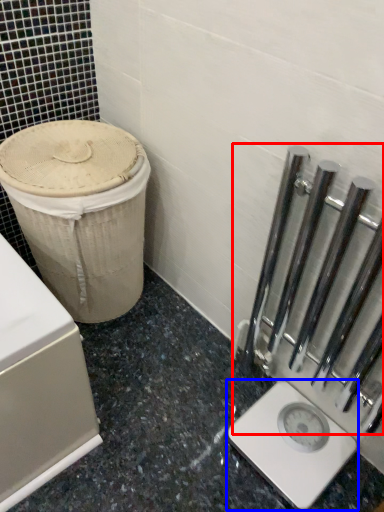
Question: Which point is closer to the camera, rail (highlighted by a red box) or scale (highlighted by a blue box)?

Choices:
 (A) rail
 (B) scale

Answer: (A)